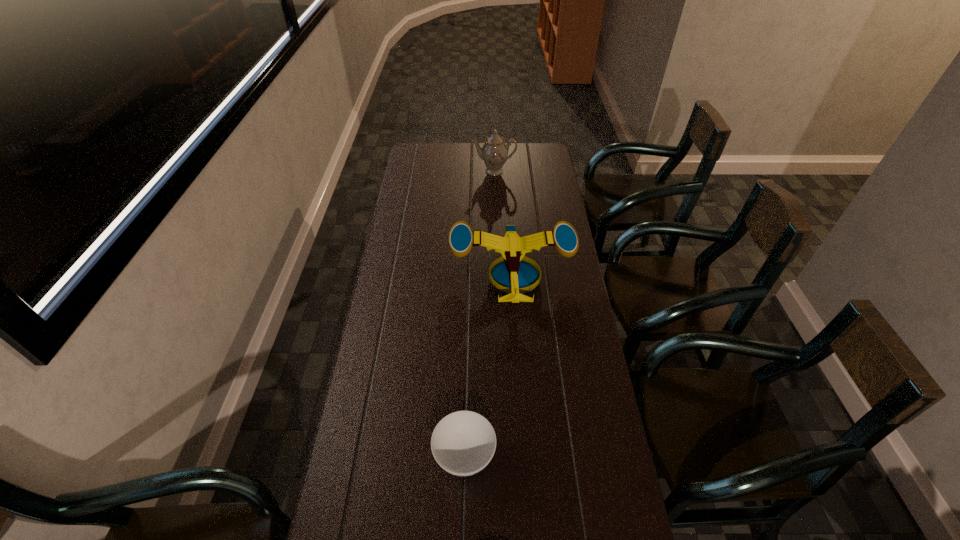
The image size is (960, 540). Find the location of `the farther chinaware`. the farther chinaware is located at coordinates (494, 152).

Image resolution: width=960 pixels, height=540 pixels. Find the location of `the tallest object`. the tallest object is located at coordinates pos(494,152).

I want to click on the second nearest object, so click(x=517, y=274).

Where is `drone`? drone is located at coordinates (517, 274).

Locate an element on the screen. Image resolution: width=960 pixels, height=540 pixels. the shorter chinaware is located at coordinates point(463,443).

Locate an element on the screen. Image resolution: width=960 pixels, height=540 pixels. the shortest object is located at coordinates (463, 443).

Identify the location of vacant space positioned 0.240m on the spout of the tallest object. (495, 208).

I want to click on free space located at the cockpit of the second farthest object, so click(520, 391).

Image resolution: width=960 pixels, height=540 pixels. Find the location of `vacant space located 0.070m on the right of the shorter chinaware`. vacant space located 0.070m on the right of the shorter chinaware is located at coordinates click(521, 455).

This screenshot has width=960, height=540. In order to click on object at the far edge in this screenshot , I will do `click(494, 152)`.